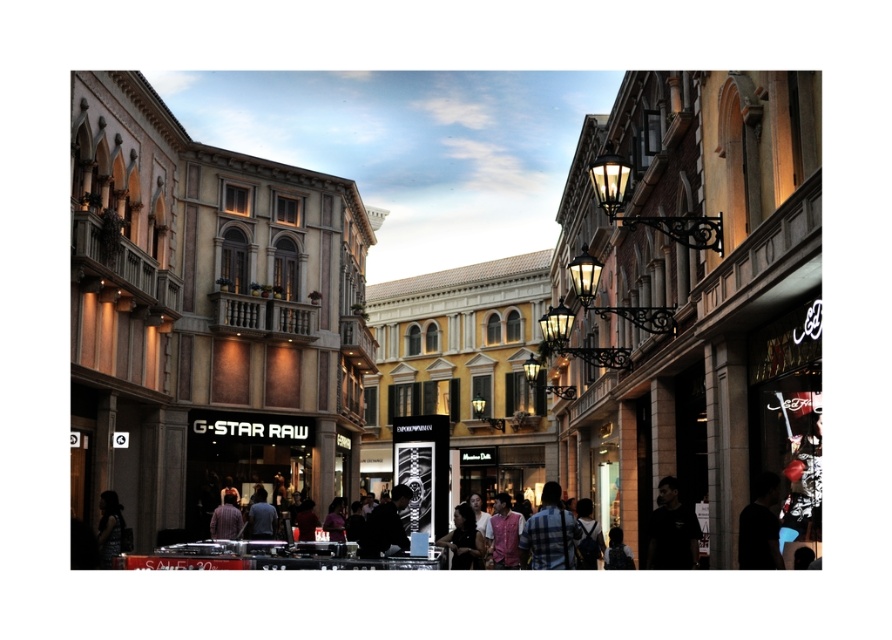
Question: Considering the real-world distances, which object is farthest from the dark gray sweater at center?

Choices:
 (A) plaid shirt at center
 (B) blue fabric shirt at center
 (C) matte black mall at center
 (D) black matte shirt at lower right

Answer: (C)

Question: Does plaid shirt at center appear on the right side of blue fabric shirt at center?

Choices:
 (A) no
 (B) yes

Answer: (B)

Question: Which point appears farthest from the camera in this image?

Choices:
 (A) (112, 545)
 (B) (552, 257)

Answer: (B)

Question: From the image, what is the correct spatial relationship of pink fabric shirt at center in relation to dark gray sweater at center?

Choices:
 (A) above
 (B) below

Answer: (B)

Question: Which is farther from the striped fabric shirt at center?

Choices:
 (A) dark hair at center
 (B) black matte shirt at lower right
 (C) silhouette fabric at lower left
 (D) dark hair at lower right

Answer: (D)

Question: Is striped fabric shirt at center smaller than dark hair at center?

Choices:
 (A) no
 (B) yes

Answer: (A)